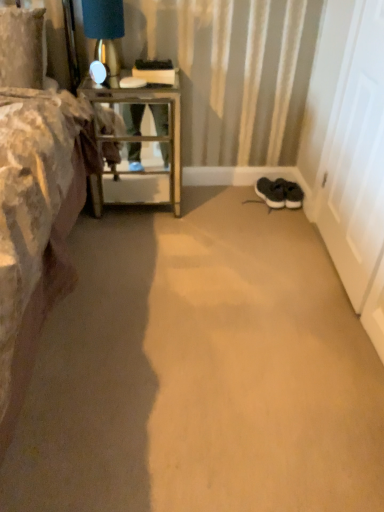
Locate an element on the screen. white matte door at right is located at coordinates (353, 154).

The width and height of the screenshot is (384, 512). I want to click on black suede sneakers at lower right, so click(279, 193).

Describe the element at coordinates (279, 193) in the screenshot. I see `black suede sneakers at lower right` at that location.

Find the location of a particular element. white matte door at right is located at coordinates (353, 154).

Is metallic glass table at left behind white matte door at right?

Yes, it is.

How many degrees apart are the facing directions of metallic glass table at left and white matte door at right?

They differ by 89.5 degrees in their facing directions.

Visually, is metallic glass table at left positioned to the left or to the right of white matte door at right?

Clearly, metallic glass table at left is on the left of white matte door at right in the image.

Can you confirm if metallic glass table at left is bigger than white matte door at right?

Yes, metallic glass table at left is bigger than white matte door at right.

Which of these two, white matte door at right or black suede sneakers at lower right, stands taller?

white matte door at right.

From the picture: How many degrees apart are the facing directions of white matte door at right and black suede sneakers at lower right?

The angle between the facing direction of white matte door at right and the facing direction of black suede sneakers at lower right is 101 degrees.

From the image's perspective, who appears lower, white matte door at right or black suede sneakers at lower right?

black suede sneakers at lower right.

Is matte gold table lamp at upper left positioned with its back to white matte door at right?

No.

What's the angular difference between matte gold table lamp at upper left and white matte door at right's facing directions?

They differ by 89.5 degrees in their facing directions.

From the picture: Based on their sizes in the image, would you say matte gold table lamp at upper left is bigger or smaller than white matte door at right?

In the image, matte gold table lamp at upper left appears to be smaller than white matte door at right.

Which is more to the right, black suede sneakers at lower right or metallic glass table at left?

Positioned to the right is black suede sneakers at lower right.

Does point (276, 195) come behind point (139, 92)?

Yes, it is.

Relative to metallic glass table at left, is black suede sneakers at lower right in front or behind?

In the image, black suede sneakers at lower right appears behind metallic glass table at left.

Which of these two, black suede sneakers at lower right or metallic glass table at left, is thinner?

black suede sneakers at lower right.

Does metallic glass table at left contain black suede sneakers at lower right?

No.

From the image's perspective, which object appears higher, metallic glass table at left or black suede sneakers at lower right?

metallic glass table at left.

Is metallic glass table at left at the right side of black suede sneakers at lower right?

Incorrect, metallic glass table at left is not on the right side of black suede sneakers at lower right.

Which is in front, point (157, 192) or point (274, 181)?

Point (157, 192)

Find the location of a particular element. The image size is (384, 512). screen door in front of the black suede sneakers at lower right is located at coordinates (353, 154).

Is white matte door at right at the back of black suede sneakers at lower right?

black suede sneakers at lower right is not turned away from white matte door at right.

Consider the image. Considering the positions of objects black suede sneakers at lower right and white matte door at right in the image provided, who is more to the right, black suede sneakers at lower right or white matte door at right?

white matte door at right.

In terms of height, does black suede sneakers at lower right look taller or shorter compared to white matte door at right?

Clearly, black suede sneakers at lower right is shorter compared to white matte door at right.

Considering the positions of points (84, 8) and (261, 182), is point (84, 8) farther from camera compared to point (261, 182)?

No, it is not.

Is black suede sneakers at lower right completely or partially inside matte gold table lamp at upper left?

No, matte gold table lamp at upper left does not contain black suede sneakers at lower right.

Who is bigger, matte gold table lamp at upper left or black suede sneakers at lower right?

matte gold table lamp at upper left is bigger.

The width and height of the screenshot is (384, 512). I want to click on nightstand that is on the left side of white matte door at right, so click(139, 143).

Locate an element on the screen. The height and width of the screenshot is (512, 384). footwear that appears below the white matte door at right (from the image's perspective) is located at coordinates tap(279, 193).

Consider the image. Which object lies nearer to the anchor point matte gold table lamp at upper left, metallic glass table at left or white matte door at right?

metallic glass table at left lies closer to matte gold table lamp at upper left than the other object.

Looking at this image, considering their positions, is black suede sneakers at lower right positioned further to white matte door at right than matte gold table lamp at upper left?

matte gold table lamp at upper left is further to white matte door at right.

Considering their positions, is matte gold table lamp at upper left positioned closer to metallic glass table at left than white matte door at right?

matte gold table lamp at upper left is closer to metallic glass table at left.

Looking at the image, which one is located further to metallic glass table at left, white matte door at right or black suede sneakers at lower right?

white matte door at right lies further to metallic glass table at left than the other object.

In the scene shown: Based on their spatial positions, is metallic glass table at left or matte gold table lamp at upper left further from white matte door at right?

The object further to white matte door at right is matte gold table lamp at upper left.

Considering their positions, is white matte door at right positioned closer to matte gold table lamp at upper left than metallic glass table at left?

The object closer to matte gold table lamp at upper left is metallic glass table at left.

Looking at the image, which one is located further to black suede sneakers at lower right, matte gold table lamp at upper left or white matte door at right?

matte gold table lamp at upper left.

Based on their spatial positions, is metallic glass table at left or black suede sneakers at lower right further from white matte door at right?

metallic glass table at left.

At what (x,y) coordinates should I click in order to perform the action: click on table lamp positioned between white matte door at right and black suede sneakers at lower right from near to far. Please return your answer as a coordinate pair (x, y). This screenshot has width=384, height=512. Looking at the image, I should click on (104, 30).

The image size is (384, 512). Identify the location of nightstand between matte gold table lamp at upper left and white matte door at right. (139, 143).

Where is `nightstand between matte gold table lamp at upper left and black suede sneakers at lower right from left to right`? This screenshot has height=512, width=384. nightstand between matte gold table lamp at upper left and black suede sneakers at lower right from left to right is located at coordinates (x=139, y=143).

At what (x,y) coordinates should I click in order to perform the action: click on nightstand between white matte door at right and black suede sneakers at lower right along the z-axis. Please return your answer as a coordinate pair (x, y). Image resolution: width=384 pixels, height=512 pixels. Looking at the image, I should click on (139, 143).